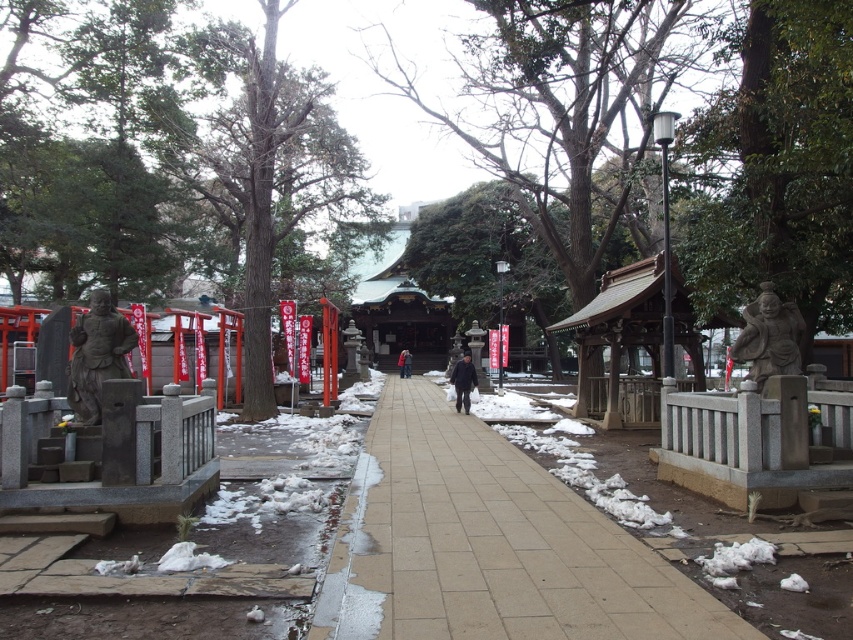
From the picture: You are visiting the shrine and want to take a photo of both stone statues. You are standing at the center of the path. Which direction should you face to ensure both stone statue at left and stone statue at right are in your camera frame?

You should face forward because both stone statue at left and stone statue at right are positioned to the sides of the path, with the stone statue at left to the left of stone statue at right. Facing forward from the center will keep both in view.

You are a visitor at the shrine and want to walk from the entrance to the main hall. You see the smooth concrete pavement at center and the dark brown leather jacket at center. Which object is closer to your current position?

The smooth concrete pavement at center is closer to your current position because it is in front of the dark brown leather jacket at center, meaning it is nearer to you as you approach the shrine.

You are a visitor at the shrine and want to take a photo of both the stone statue at right and the dark blue fabric coat at center. Since you only have one shot, will you be able to capture both in the same frame without moving your camera? Explain why or why not based on their positions.

The stone statue at right is located above the dark blue fabric coat at center, so if the camera is positioned to include both vertical positions, they can be captured in the same frame. However, if the statue is too high or the coat too low, adjustments might be needed to ensure both are within the camera view.